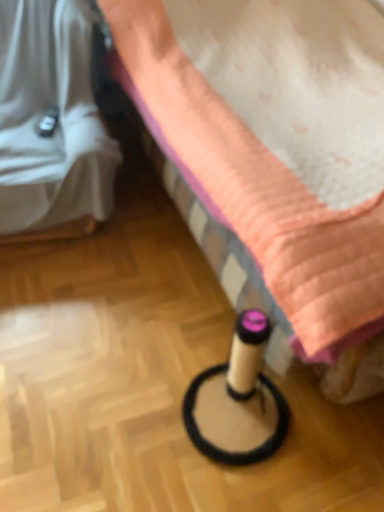
Locate an element on the screen. free spot in front of white fabric at left, the 2th furniture viewed from the right is located at coordinates (86, 312).